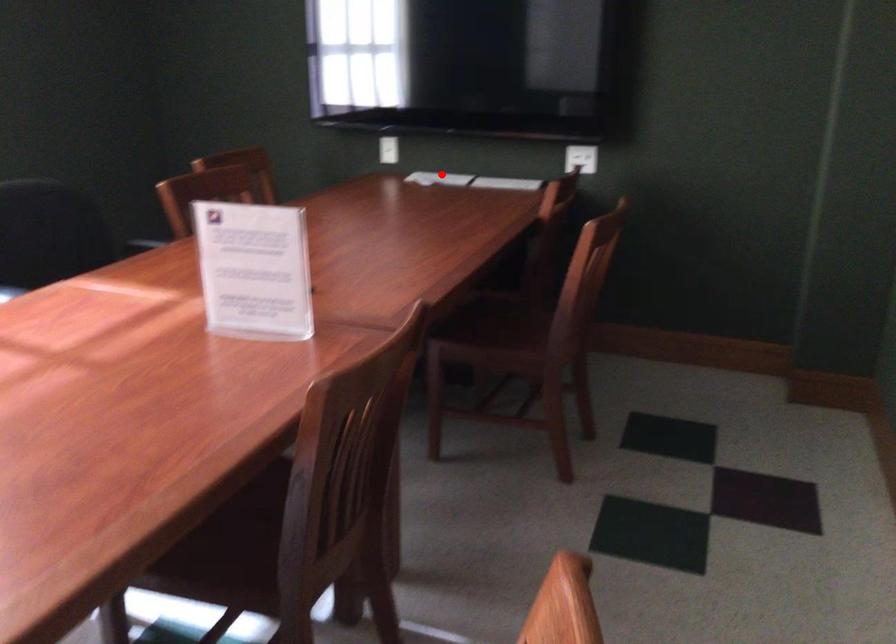
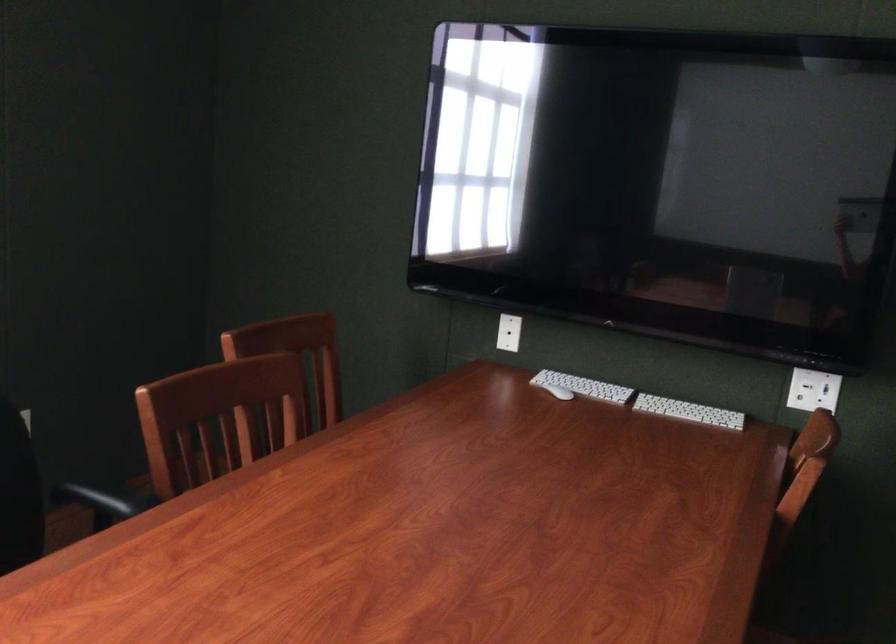
In the second image, find the point that corresponds to the highlighted location in the first image.

(583, 386)